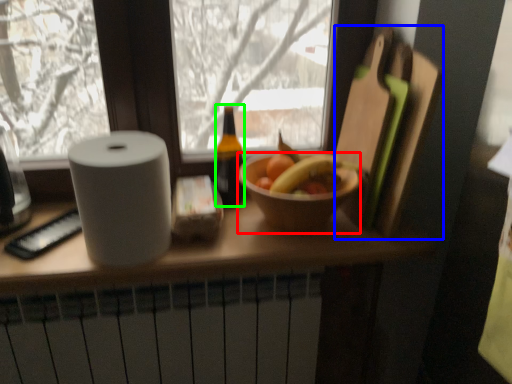
Question: Based on their relative distances, which object is nearer to bowl (highlighted by a red box)? Choose from cutting board (highlighted by a blue box) and bottle (highlighted by a green box).

Choices:
 (A) cutting board
 (B) bottle

Answer: (A)